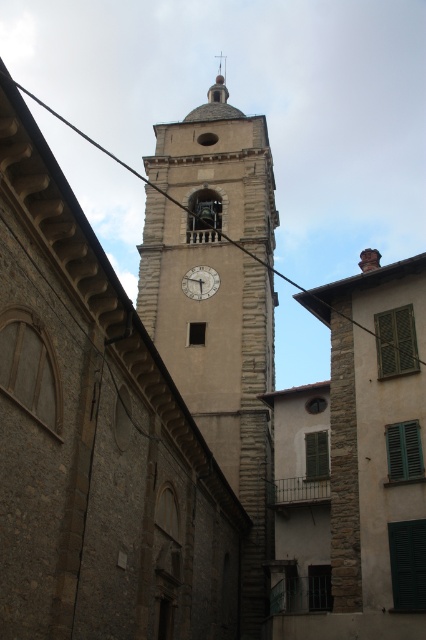
Question: Does black wire at upper center come in front of white matte clock at center?

Choices:
 (A) no
 (B) yes

Answer: (B)

Question: Among these objects, which one is farthest from the camera?

Choices:
 (A) black wire at upper center
 (B) beige stone clock tower at center
 (C) white matte clock at center

Answer: (C)

Question: From the image, what is the correct spatial relationship of beige stone clock tower at center in relation to white matte clock at center?

Choices:
 (A) left
 (B) right

Answer: (B)

Question: Does beige stone clock tower at center have a lesser width compared to black wire at upper center?

Choices:
 (A) yes
 (B) no

Answer: (A)

Question: Which point appears farthest from the camera in this image?

Choices:
 (A) (207, 282)
 (B) (178, 276)

Answer: (B)

Question: Which object is closer to the camera taking this photo?

Choices:
 (A) white matte clock at center
 (B) black wire at upper center

Answer: (B)